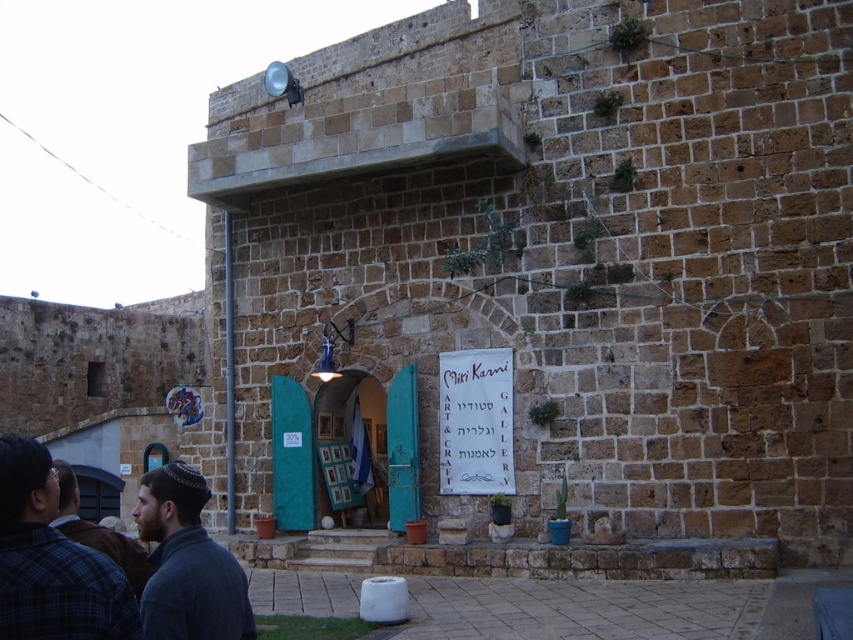
You are a tailor who needs to locate the plaid fabric shirt at lower left. According to the coordinates provided, where exactly should you look on the image?

The plaid fabric shirt at lower left is located at point (x=51, y=561) on the image.